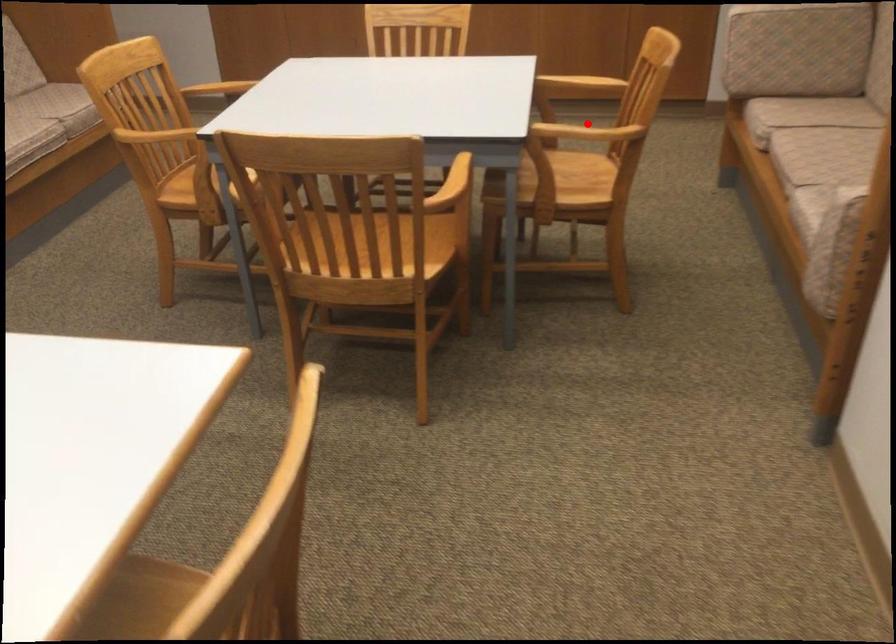
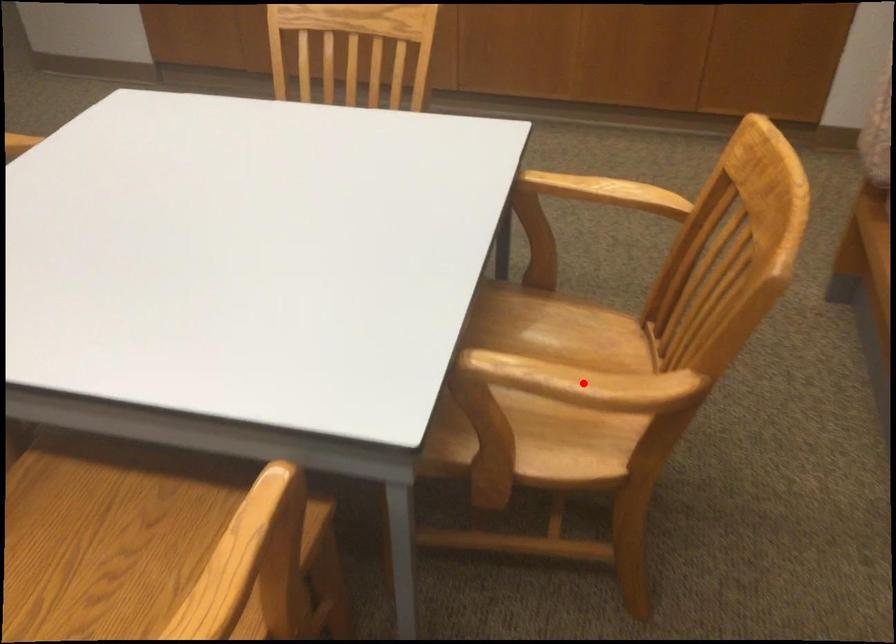
I am providing you with two images of the same scene from different viewpoints. A red point is marked on the first image and another point is marked on the second image. Does the point marked in image1 correspond to the same location as the one in image2?

Yes